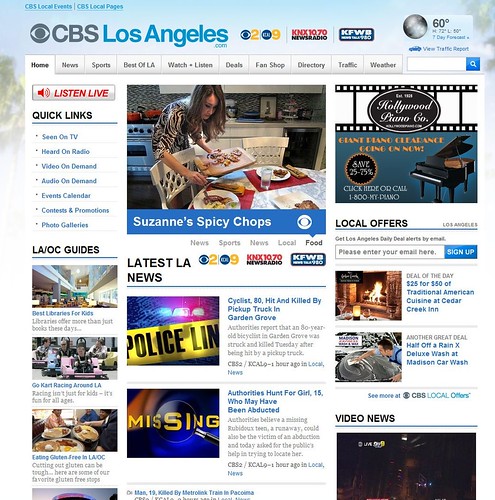
Locate an element on the screen. This screenshot has width=495, height=500. red placemat is located at coordinates (282, 182).